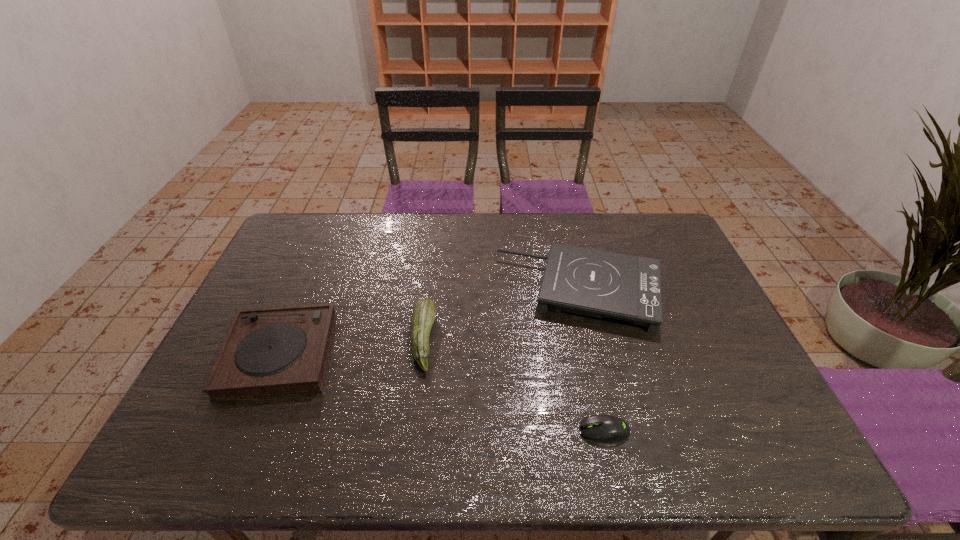
Locate an element on the screen. The width and height of the screenshot is (960, 540). the third object from right to left is located at coordinates (424, 312).

Locate an element on the screen. The image size is (960, 540). hotplate is located at coordinates (590, 282).

Identify the location of the leftmost object. This screenshot has width=960, height=540. (270, 351).

At what (x,y) coordinates should I click in order to perform the action: click on computer mouse. Please return your answer as a coordinate pair (x, y). The image size is (960, 540). Looking at the image, I should click on (602, 428).

Where is `the nearest object`? The height and width of the screenshot is (540, 960). the nearest object is located at coordinates (602, 428).

This screenshot has width=960, height=540. In order to click on free space located at the stem end of the zucchini in this screenshot , I will do `click(491, 340)`.

What are the coordinates of `free region located on the left of the hotplate` in the screenshot? It's located at (436, 292).

The image size is (960, 540). Identify the location of free space located 0.250m on the back of the leftmost object. pos(320,259).

Find the location of a particular element. vacant space located on the wheel side of the nearest object is located at coordinates (465, 430).

This screenshot has height=540, width=960. What are the coordinates of `vacant space located 0.340m on the wheel side of the nearest object` in the screenshot? It's located at (430, 430).